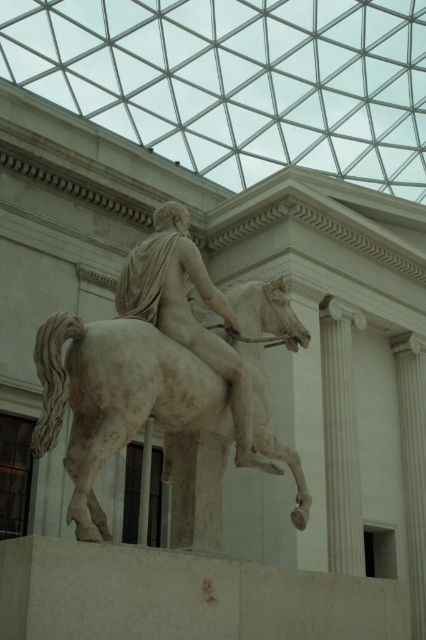
From the picture: You are an art conservator examining the statue from the front. You notice two points on the statue marked at coordinates point (210, 355) and point (357, 508). Which point is nearer to your current position?

Point (210, 355) is closer to the viewer than point (357, 508).

From the picture: You are an art conservator assessing the placement of the white marble statue at center and the white marble column at center. Based on their positioning, which object is located above the other?

The white marble statue at center is positioned over the white marble column at center, so the statue is above the column.